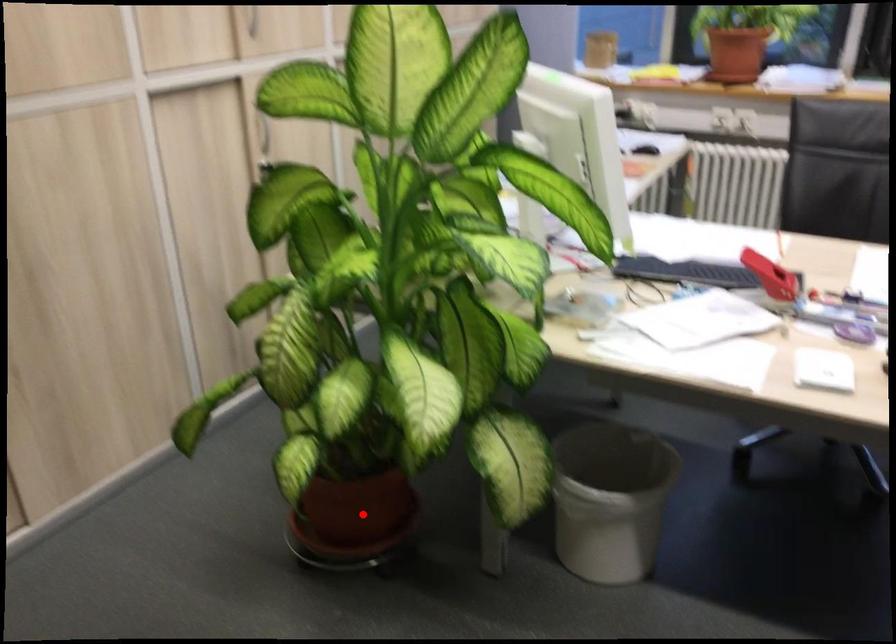
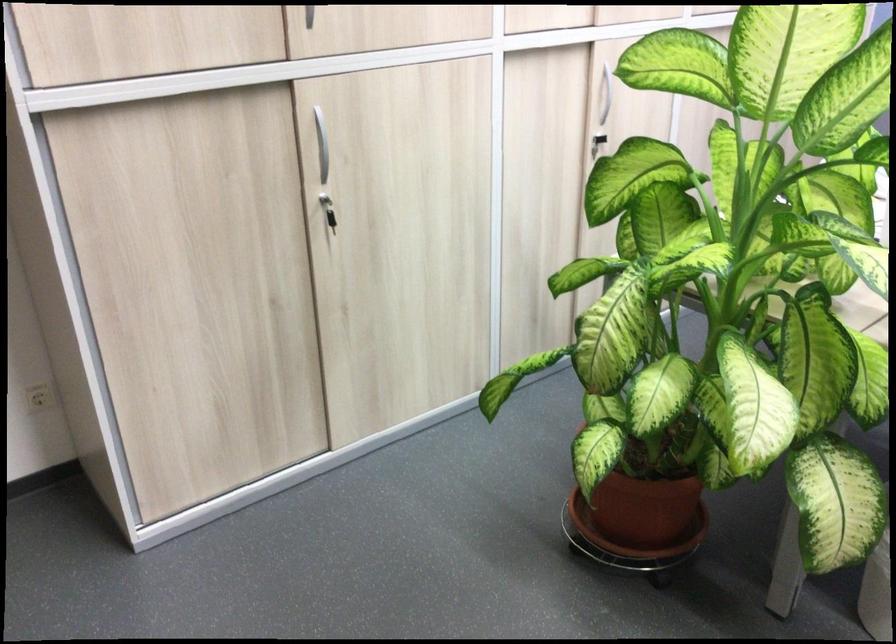
Where in the second image is the point corresponding to the highlighted location from the first image?

(643, 509)